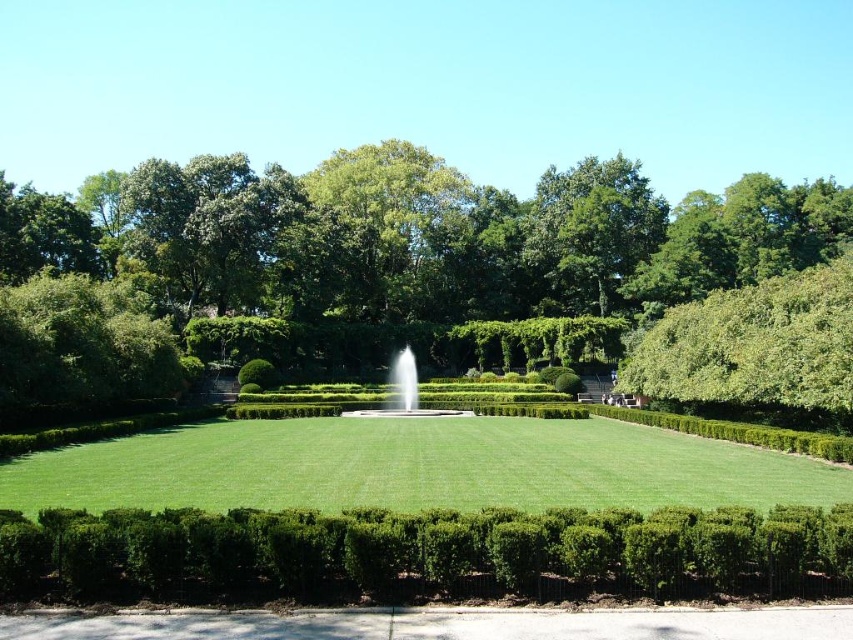
You are planning to place a new bench in the garden. The bench requires a space wider than the green lawn at center. Can the green leafy tree at center provide enough space for the bench?

The green leafy tree at center has a width larger than the green lawn at center, so yes, the bench can be placed there as it provides sufficient space.

You are planning to place a new statue that is 2 meters wide in the garden. Given the current layout with the green leafy tree at center and the white marble fountain at center, which object would you need to consider in terms of space availability for the statue?

The green leafy tree at center is bigger than the white marble fountain at center, so you should consider the space around the white marble fountain at center since it takes up less area.